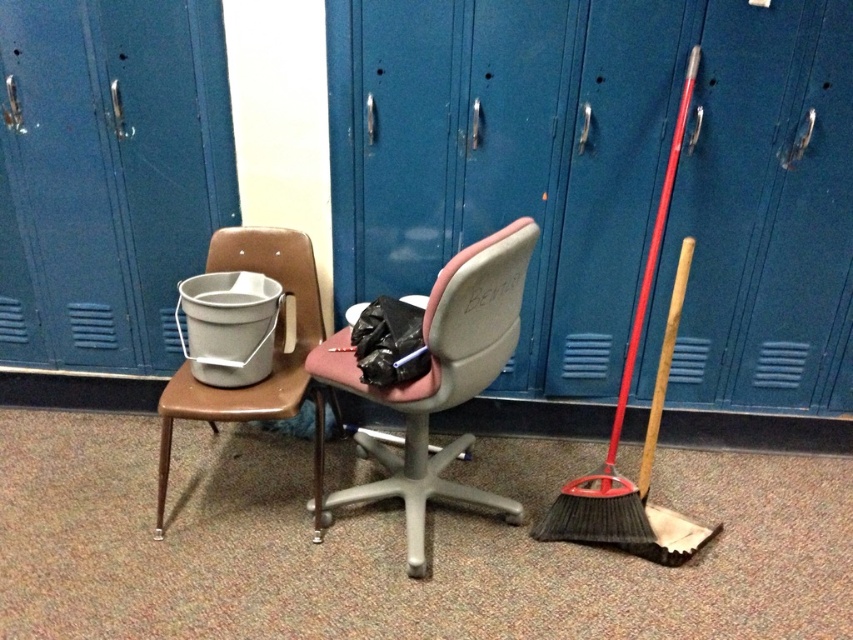
You are standing in a school hallway and see the pink fabric office chair at center and the metallic brown chair at left. Which chair is closer to you?

The pink fabric office chair at center is closer to you because it is in front of the metallic brown chair at left.

You are standing at the point with coordinates point (440, 380). Looking around, you see a simple brown chair with a light colored seat and backrest and a pink fabric office chair at center. Which chair are you currently standing on?

You are standing on the pink fabric office chair at center because the point (440, 380) corresponds to it according to the coordinates provided.